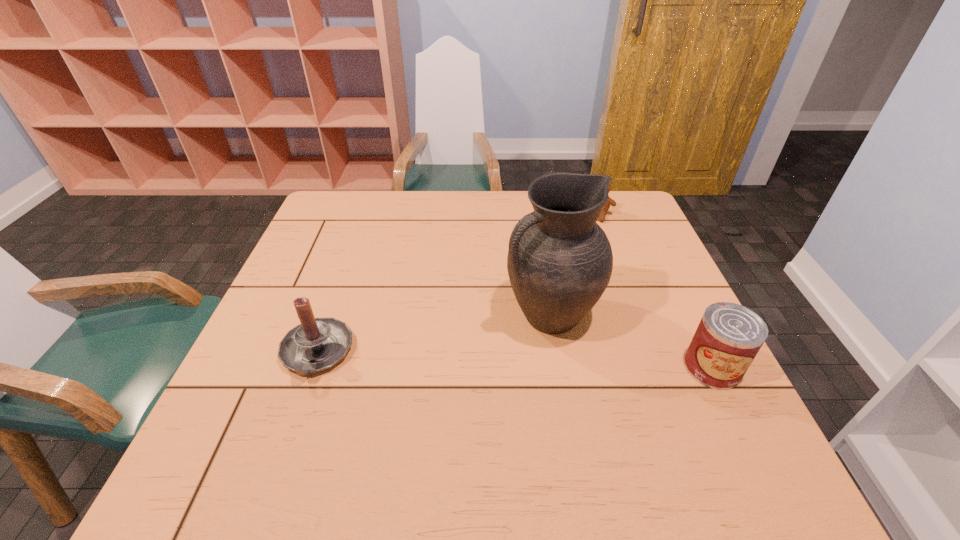
Identify the location of vacant spot on the desktop that is between the leftmost object and the can and is positioned on the front-facing side of the teddy bear. This screenshot has width=960, height=540. (519, 361).

Identify the location of free space on the desktop that is between the leftmost object and the can and is positioned on the side of the pitcher with the handle. (462, 359).